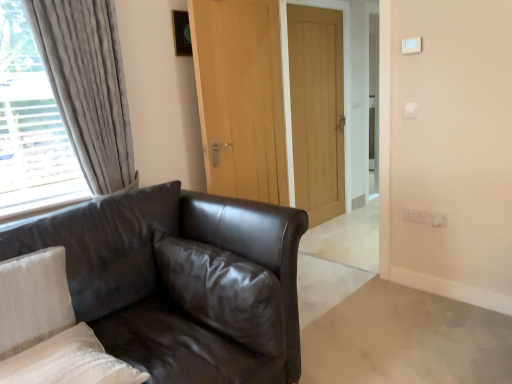
Question: Which direction should I rotate to look at glossy leather pillow at center, acting as the 1th pillow starting from the right?

Choices:
 (A) right
 (B) left

Answer: (B)

Question: Is white textured pillow at lower left, the second pillow positioned from the left, far away from velvet grey curtain at left?

Choices:
 (A) yes
 (B) no

Answer: (A)

Question: Can you confirm if white textured pillow at lower left, marked as the second pillow in a right-to-left arrangement, is smaller than velvet grey curtain at left?

Choices:
 (A) yes
 (B) no

Answer: (A)

Question: Considering the relative positions of white textured pillow at lower left, marked as the second pillow in a right-to-left arrangement, and velvet grey curtain at left in the image provided, is white textured pillow at lower left, marked as the second pillow in a right-to-left arrangement, to the right of velvet grey curtain at left from the viewer's perspective?

Choices:
 (A) no
 (B) yes

Answer: (B)

Question: Is white textured pillow at lower left, marked as the second pillow in a right-to-left arrangement, aimed at velvet grey curtain at left?

Choices:
 (A) no
 (B) yes

Answer: (A)

Question: Can we say white textured pillow at lower left, marked as the second pillow in a right-to-left arrangement, lies outside velvet grey curtain at left?

Choices:
 (A) yes
 (B) no

Answer: (A)

Question: Considering the relative positions of white textured pillow at lower left, the second pillow positioned from the left, and velvet grey curtain at left in the image provided, is white textured pillow at lower left, the second pillow positioned from the left, to the left of velvet grey curtain at left from the viewer's perspective?

Choices:
 (A) yes
 (B) no

Answer: (B)

Question: Can you confirm if glossy leather pillow at center, positioned as the 3th pillow in left-to-right order, is wider than white textured pillow at lower left, marked as the second pillow in a right-to-left arrangement?

Choices:
 (A) no
 (B) yes

Answer: (A)

Question: Can you confirm if glossy leather pillow at center, positioned as the 3th pillow in left-to-right order, is taller than white textured pillow at lower left, marked as the second pillow in a right-to-left arrangement?

Choices:
 (A) yes
 (B) no

Answer: (A)

Question: From a real-world perspective, is glossy leather pillow at center, positioned as the 3th pillow in left-to-right order, located higher than white textured pillow at lower left, the second pillow positioned from the left?

Choices:
 (A) no
 (B) yes

Answer: (B)

Question: From the image's perspective, does glossy leather pillow at center, acting as the 1th pillow starting from the right, appear lower than white textured pillow at lower left, marked as the second pillow in a right-to-left arrangement?

Choices:
 (A) yes
 (B) no

Answer: (B)

Question: Is glossy leather pillow at center, acting as the 1th pillow starting from the right, bigger than white textured pillow at lower left, the second pillow positioned from the left?

Choices:
 (A) no
 (B) yes

Answer: (B)

Question: Is the depth of glossy leather pillow at center, acting as the 1th pillow starting from the right, less than that of white textured pillow at lower left, the second pillow positioned from the left?

Choices:
 (A) yes
 (B) no

Answer: (B)

Question: Is white plastic light switch at upper right, which is the 1th light switch from back to front, to the left of matte black leather couch at left from the viewer's perspective?

Choices:
 (A) yes
 (B) no

Answer: (B)